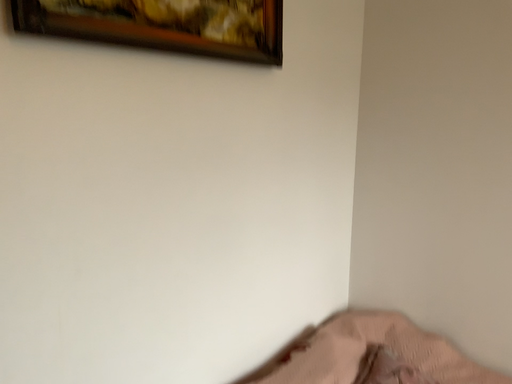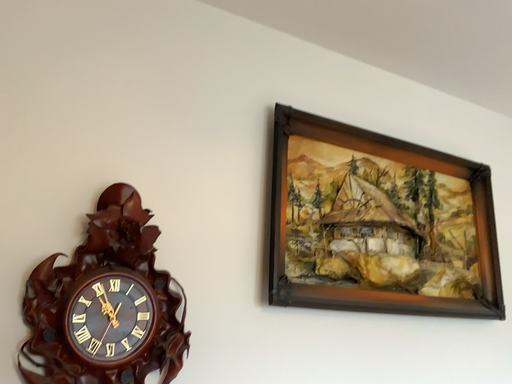
Question: How did the camera likely rotate when shooting the video?

Choices:
 (A) rotated left
 (B) rotated right

Answer: (A)